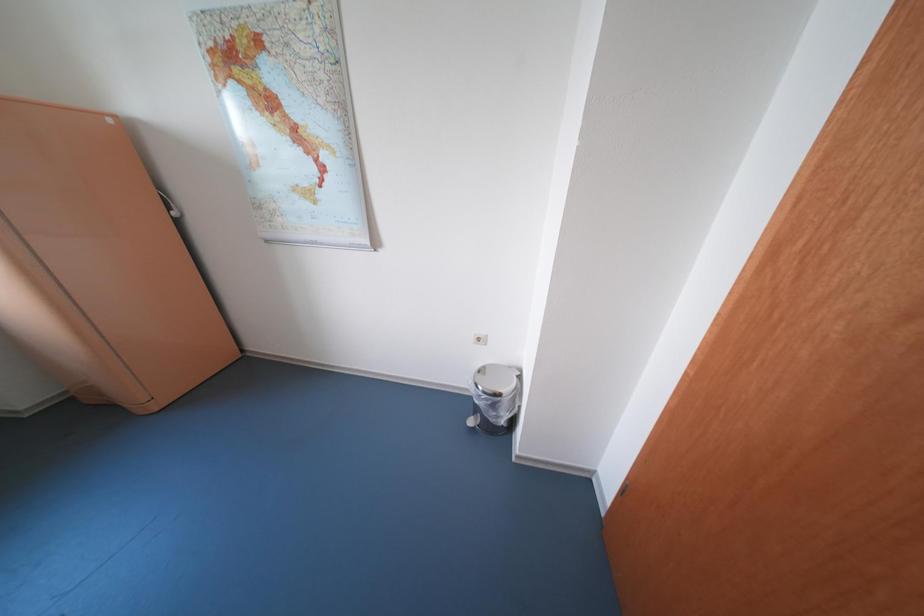
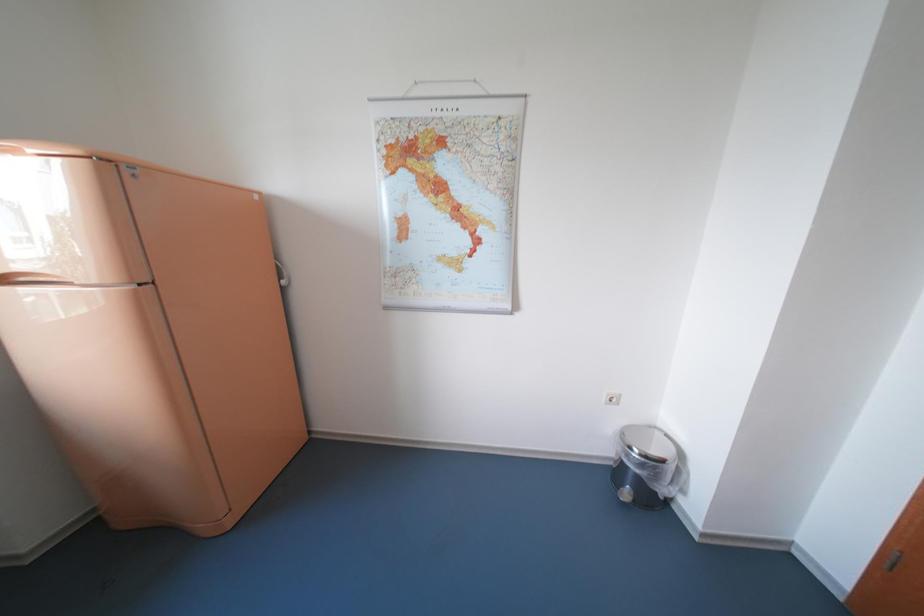
Question: What movement of the cameraman would produce the second image?

Choices:
 (A) Left
 (B) Right
 (C) Forward
 (D) Backward

Answer: (A)